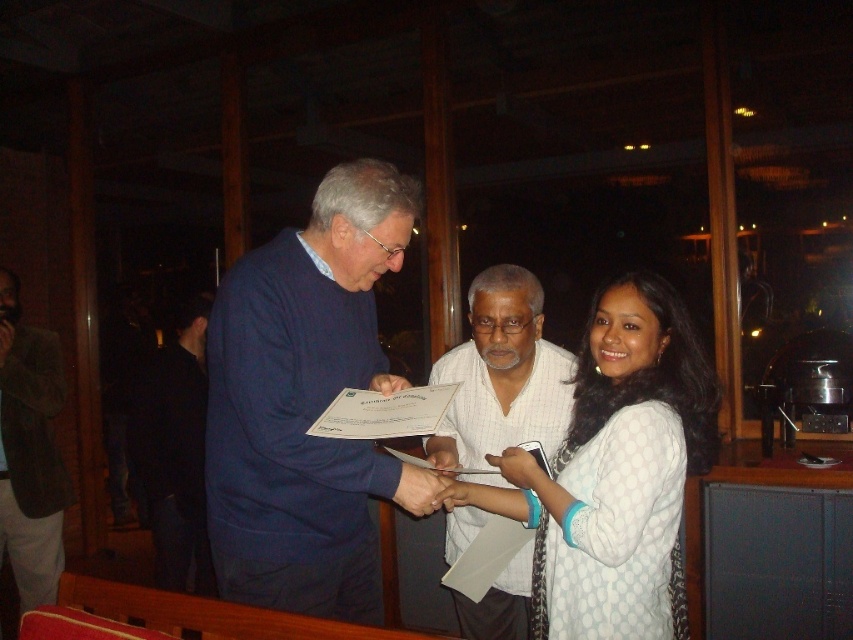
Question: Which object is the farthest from the blue sweater at center?

Choices:
 (A) black fabric shirt at left
 (B) white striped shirt at center

Answer: (A)

Question: Which object is positioned closest to the black fabric shirt at left?

Choices:
 (A) dark blue sweater at center
 (B) white striped shirt at center
 (C) white dotted dress at center

Answer: (A)

Question: Is white dotted dress at center closer to the viewer compared to white striped shirt at center?

Choices:
 (A) no
 (B) yes

Answer: (B)

Question: Which object is positioned farthest from the black fabric shirt at left?

Choices:
 (A) white striped shirt at center
 (B) white dotted dress at center
 (C) blue sweater at center
 (D) dark blue sweater at center

Answer: (B)

Question: Considering the relative positions of blue sweater at center and dark blue sweater at center in the image provided, where is blue sweater at center located with respect to dark blue sweater at center?

Choices:
 (A) left
 (B) right

Answer: (B)

Question: Can you confirm if white dotted dress at center is positioned to the right of black fabric shirt at left?

Choices:
 (A) yes
 (B) no

Answer: (A)